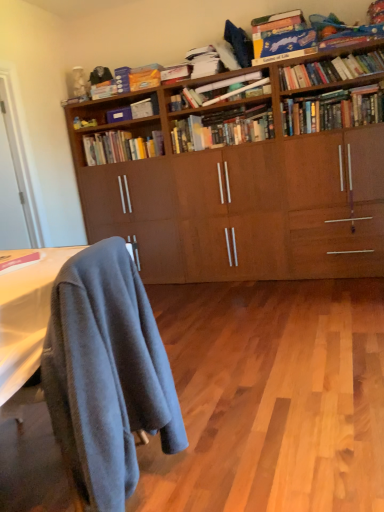
I want to click on vacant area on top of matte blue paperback book at upper center (from a real-world perspective), so click(x=121, y=110).